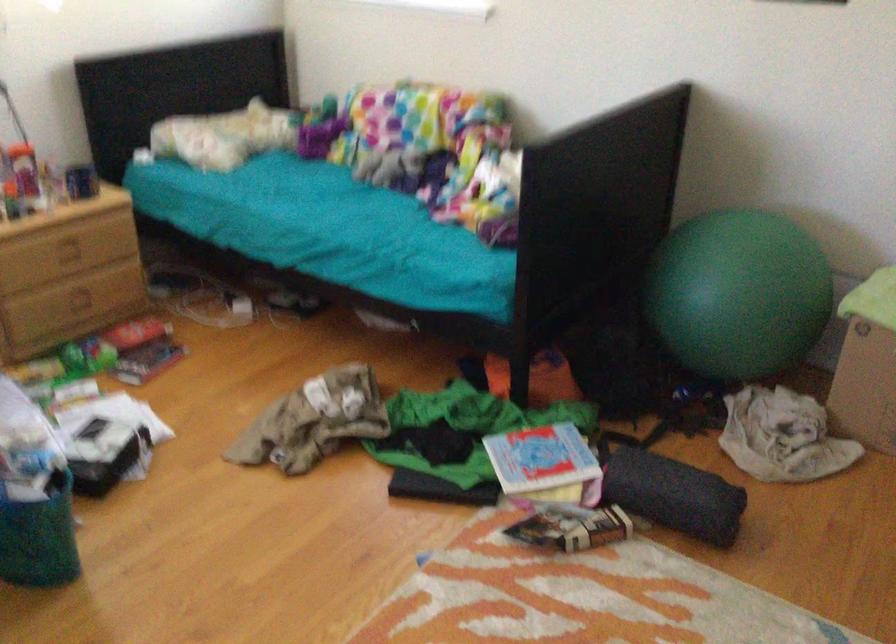
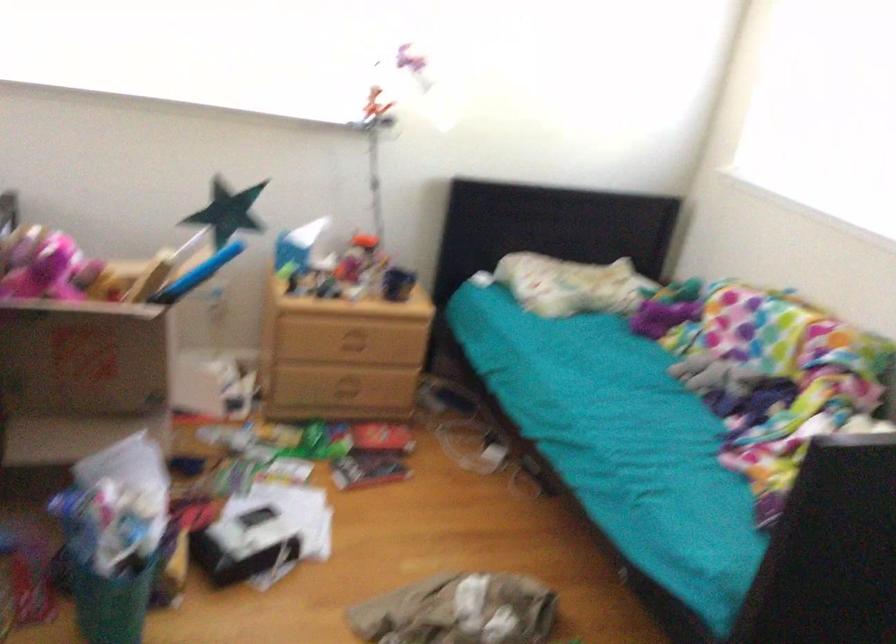
Where in the second image is the point corresponding to [240,137] from the first image?

(572, 285)